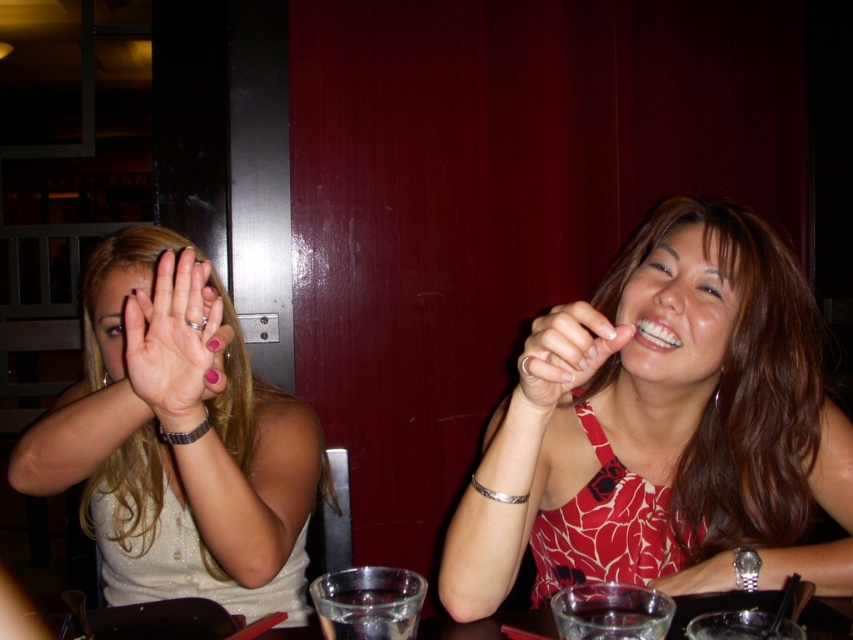
Question: Which object is positioned closest to the smooth silver ring at center?

Choices:
 (A) red floral dress at center
 (B) matte pink nail polish at center
 (C) smooth red dress at center

Answer: (C)

Question: Is red floral dress at center to the left of pink matte nail polish at center from the viewer's perspective?

Choices:
 (A) no
 (B) yes

Answer: (A)

Question: Which point is farther to the camera?

Choices:
 (A) (619, 339)
 (B) (662, 282)
 (C) (193, 284)
 (D) (166, 268)

Answer: (B)

Question: Is smooth red dress at center bigger than matte pink nail polish at center?

Choices:
 (A) yes
 (B) no

Answer: (B)

Question: Can you confirm if pink matte nail polish at center is thinner than smooth silver ring at center?

Choices:
 (A) no
 (B) yes

Answer: (A)

Question: Which point appears closest to the camera in this image?

Choices:
 (A) (196, 438)
 (B) (750, 276)
 (C) (125, 362)

Answer: (C)